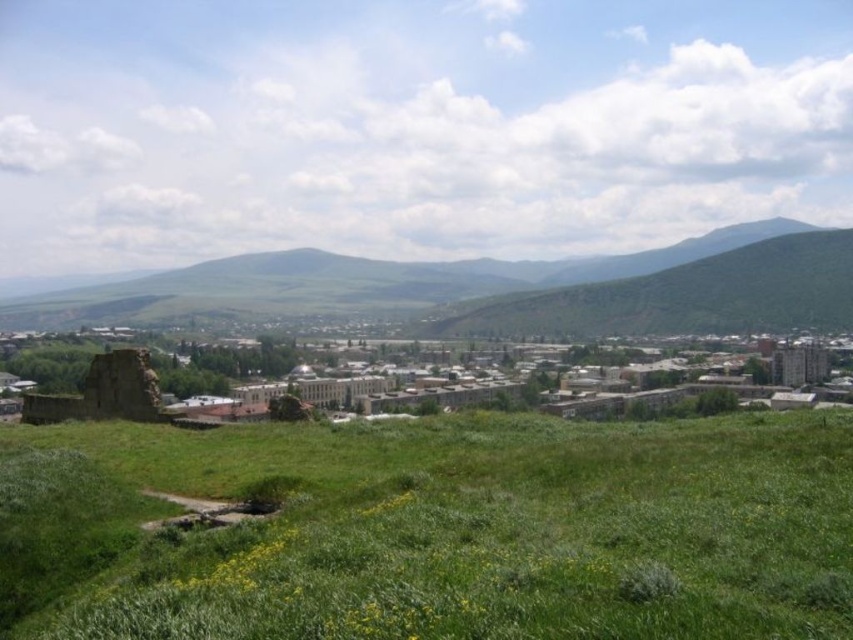
Which of these two, green grassy field at lower center or rusty stone ruin at lower left, stands taller?

Standing taller between the two is rusty stone ruin at lower left.

Does point (440, 454) lie behind point (36, 417)?

No, it is not.

Is point (119, 449) in front of point (144, 362)?

Yes, it is.

Identify the location of green grassy field at lower center. The width and height of the screenshot is (853, 640). (434, 529).

Can you confirm if green grassy hill at center is positioned above rusty stone ruin at lower left?

Indeed, green grassy hill at center is positioned over rusty stone ruin at lower left.

Can you confirm if green grassy hill at center is shorter than rusty stone ruin at lower left?

No, green grassy hill at center is not shorter than rusty stone ruin at lower left.

Which is behind, point (434, 301) or point (142, 356)?

Positioned behind is point (434, 301).

This screenshot has width=853, height=640. Find the location of `green grassy hill at center`. green grassy hill at center is located at coordinates (462, 282).

Is point (355, 515) positioned before point (780, 307)?

Yes.

Is point (109, 456) positioned in front of point (80, 317)?

Yes, it is.

Locate an element on the screen. The width and height of the screenshot is (853, 640). green grassy field at lower center is located at coordinates (434, 529).